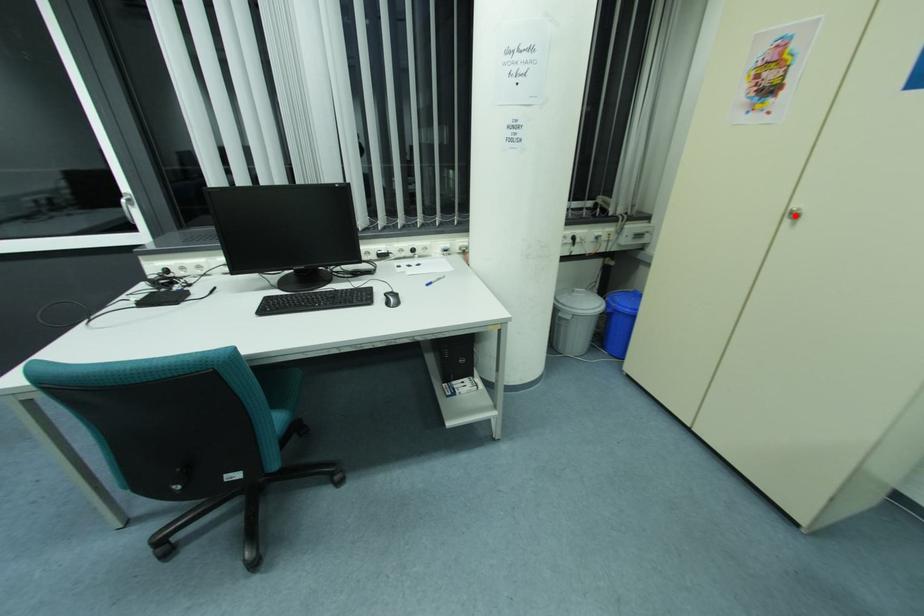
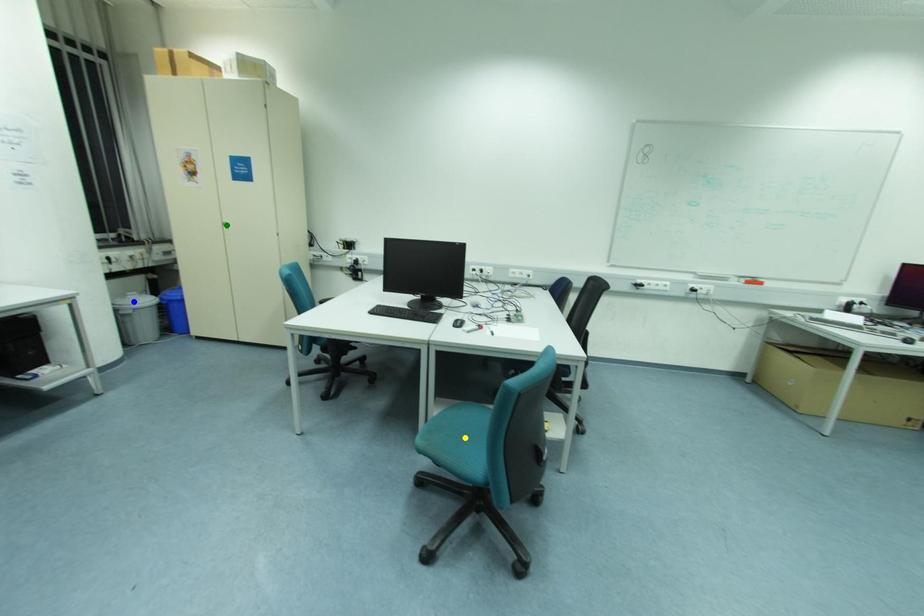
Question: I am providing you with two images of the same scene from different viewpoints. A red point is marked on the first image. You are given multiple points on the second image. Which mark in image 2 goes with the point in image 1?

Choices:
 (A) green point
 (B) blue point
 (C) yellow point

Answer: (A)